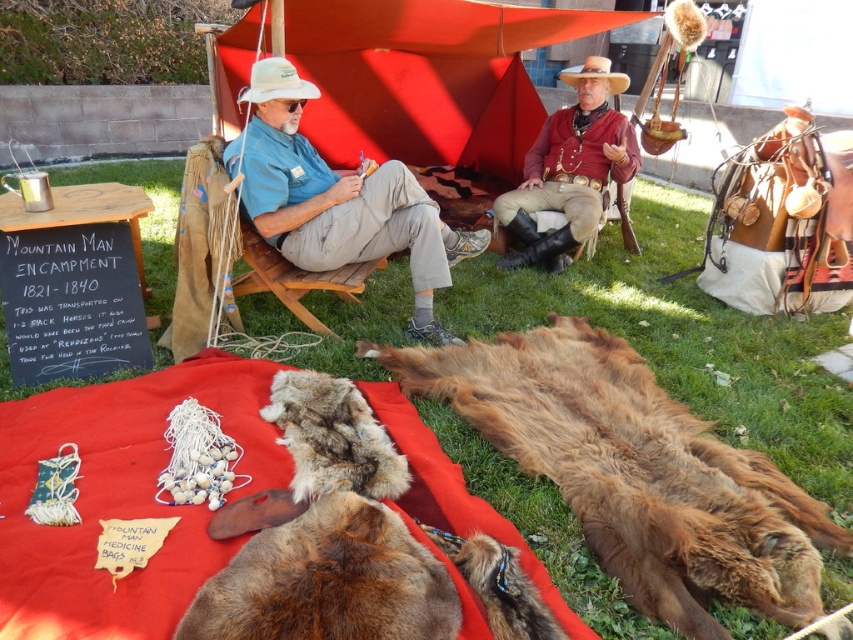
Question: Which point appears closest to the camera in this image?

Choices:
 (A) (434, 381)
 (B) (265, 92)
 (C) (335, 275)

Answer: (A)

Question: Does rustic leather cowboy hat at upper center appear over wooden chair at center?

Choices:
 (A) yes
 (B) no

Answer: (A)

Question: Is brown fur pelt at lower center bigger than wooden chair at center?

Choices:
 (A) no
 (B) yes

Answer: (B)

Question: Which object is closer to the camera taking this photo?

Choices:
 (A) wooden chair at center
 (B) brown fur pelt at lower center
 (C) red canvas tent at upper center
 (D) brown straw cowboy hat at upper center

Answer: (B)

Question: Among these points, which one is farthest from the camera?

Choices:
 (A) (595, 68)
 (B) (276, 108)

Answer: (A)

Question: Is red canvas tent at upper center thinner than wooden chair at center?

Choices:
 (A) no
 (B) yes

Answer: (A)